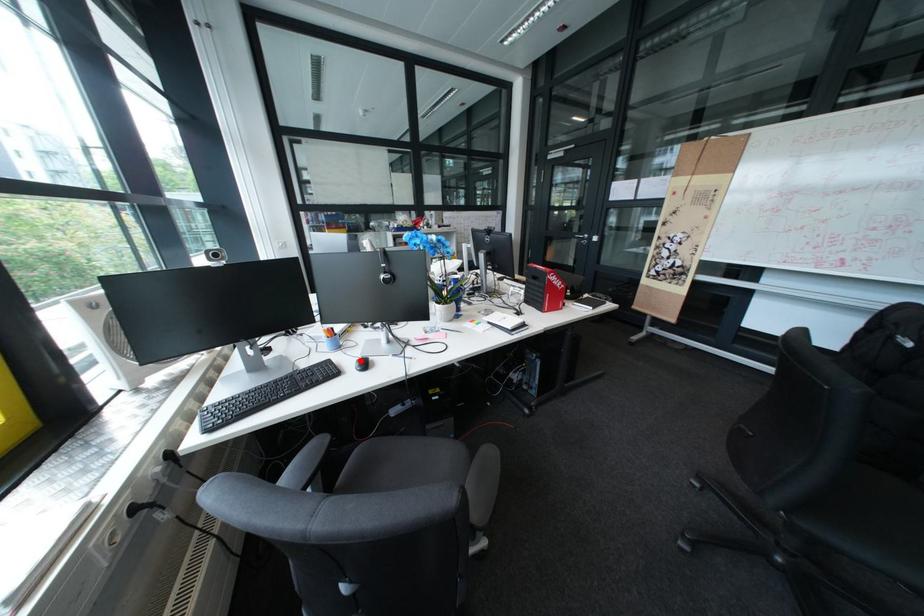
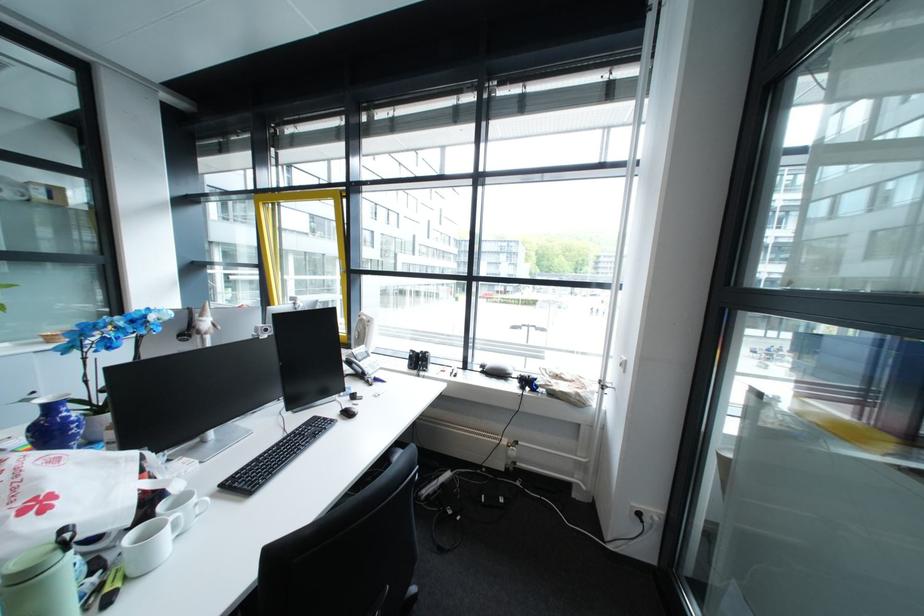
Question: I am providing you with two images of the same scene from different viewpoints. A red point is marked on the first image. Can you still see the location of the red point in image 2?

Choices:
 (A) Yes
 (B) No

Answer: (B)